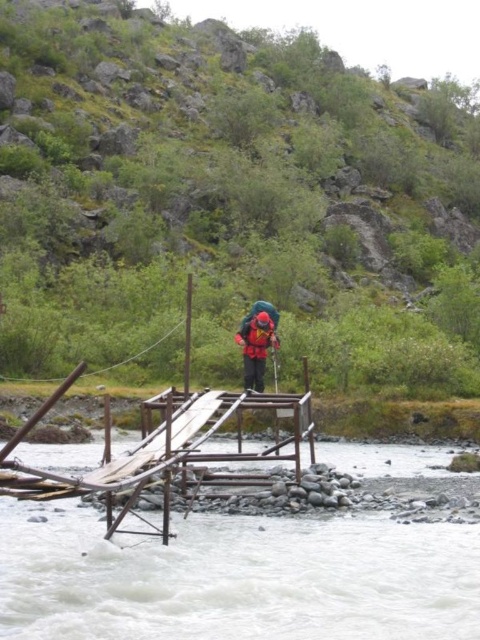
Question: Which of the following is the farthest from the observer?

Choices:
 (A) red fabric helmet at center
 (B) green grassy hillside at upper center

Answer: (B)

Question: Is green grassy hillside at upper center positioned at the back of red fabric helmet at center?

Choices:
 (A) no
 (B) yes

Answer: (B)

Question: Which is farther from the red fabric helmet at center?

Choices:
 (A) white frothy water at center
 (B) green grassy hillside at upper center

Answer: (B)

Question: Can you confirm if green grassy hillside at upper center is positioned to the right of white frothy water at center?

Choices:
 (A) yes
 (B) no

Answer: (B)

Question: Can you confirm if white frothy water at center is wider than red fabric helmet at center?

Choices:
 (A) yes
 (B) no

Answer: (A)

Question: Considering the real-world distances, which object is closest to the red fabric helmet at center?

Choices:
 (A) green grassy hillside at upper center
 (B) white frothy water at center

Answer: (B)